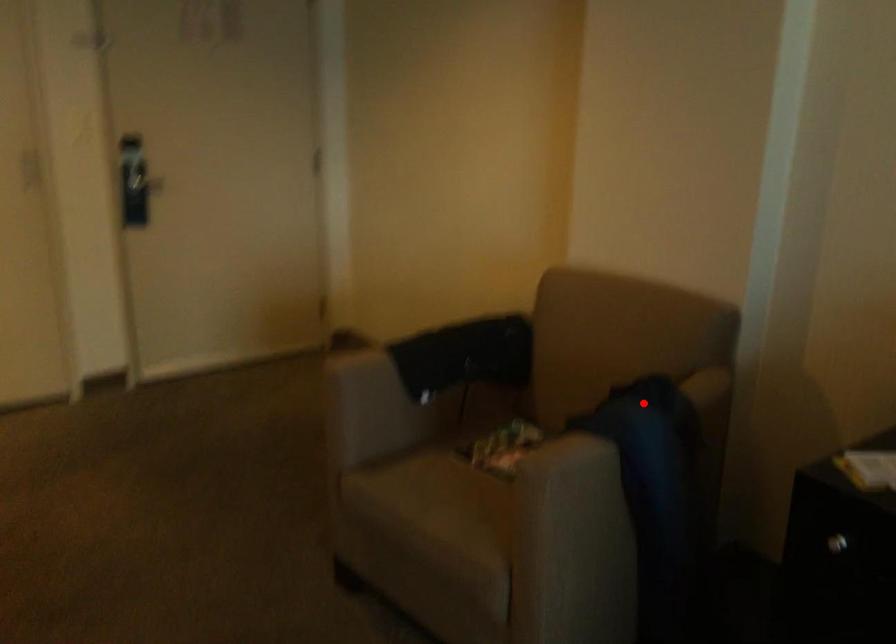
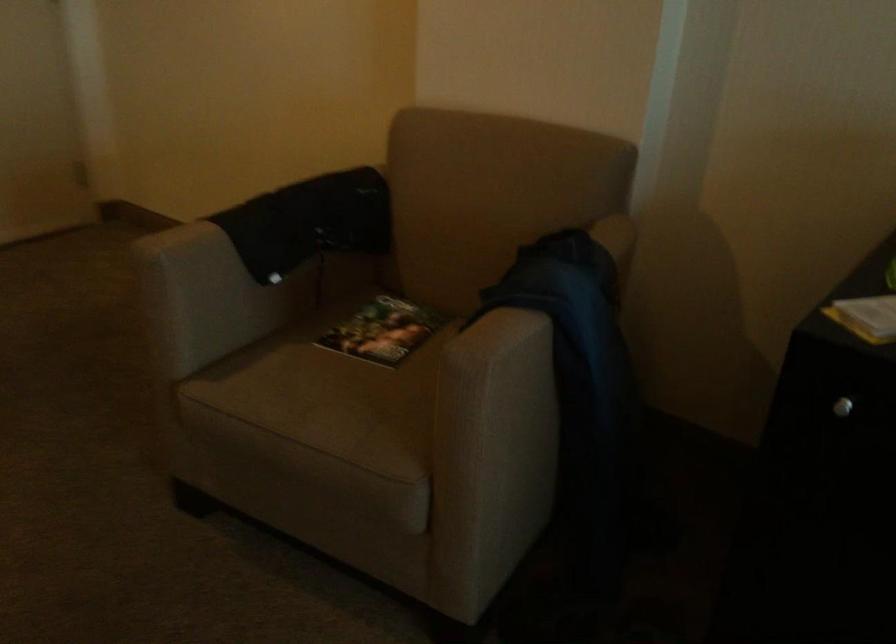
Question: I am providing you with two images of the same scene from different viewpoints. Image1 has a red point marked. In image2, the corresponding 3D location appears at what relative position? Reply with the corresponding letter.

Choices:
 (A) Closer
 (B) Farther

Answer: (A)